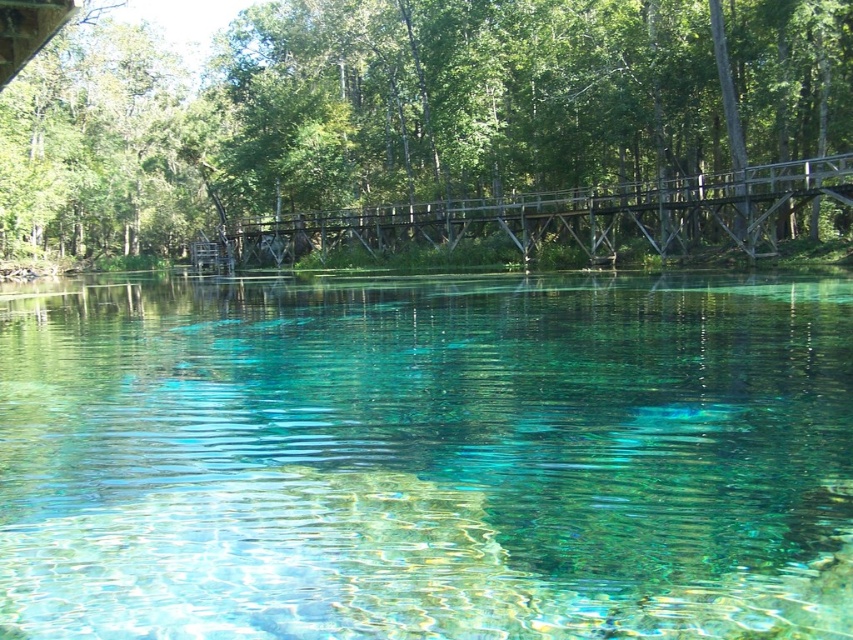
Identify the location of clear glassy water at center. The image size is (853, 640). (426, 456).

Is point (422, 557) closer to viewer compared to point (433, 224)?

That is True.

Where is `clear glassy water at center`? Image resolution: width=853 pixels, height=640 pixels. clear glassy water at center is located at coordinates pyautogui.click(x=426, y=456).

Is point (39, 448) positioned behind point (848, 36)?

No, (39, 448) is closer to viewer.

Measure the distance between clear glassy water at center and green matte bridge at upper center.

They are 122.36 feet apart.

Is point (389, 364) positioned behind point (721, 148)?

No.

Where is `clear glassy water at center`? The height and width of the screenshot is (640, 853). clear glassy water at center is located at coordinates (426, 456).

Between green matte bridge at upper center and wooden bridge at center, which one appears on the left side from the viewer's perspective?

From the viewer's perspective, green matte bridge at upper center appears more on the left side.

Is green matte bridge at upper center to the right of wooden bridge at center from the viewer's perspective?

No, green matte bridge at upper center is not to the right of wooden bridge at center.

Which is behind, point (514, 161) or point (219, 248)?

The point (219, 248) is more distant.

Where is `green matte bridge at upper center`? This screenshot has height=640, width=853. green matte bridge at upper center is located at coordinates (350, 115).